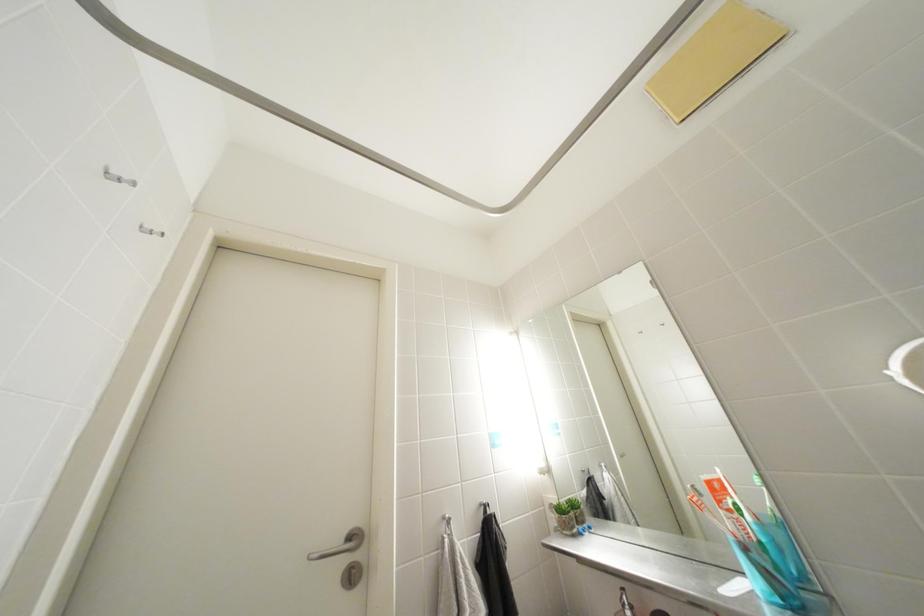
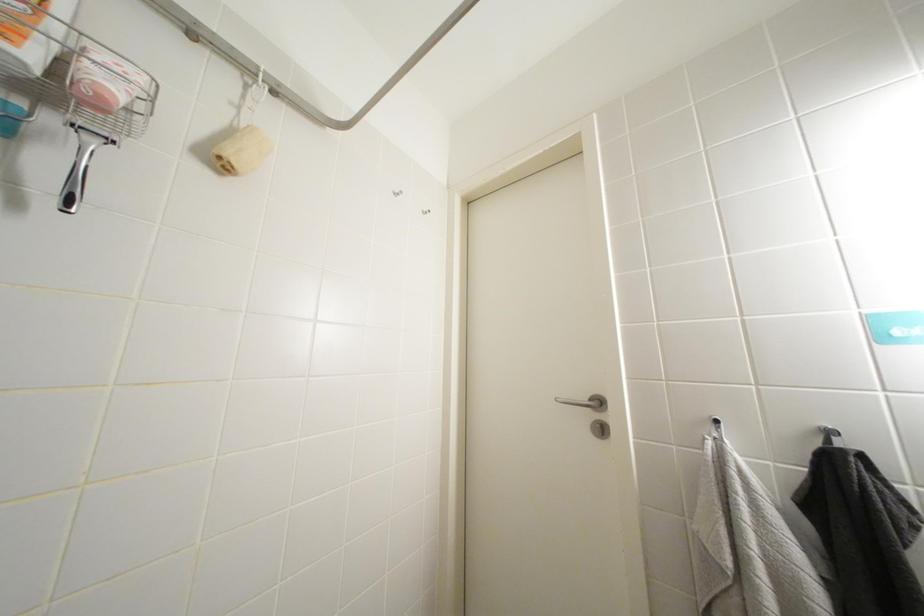
Question: The camera is either moving clockwise (left) or counter-clockwise (right) around the object. The first image is from the beginning of the video and the second image is from the end. Is the camera moving left or right when shooting the video?

Choices:
 (A) Left
 (B) Right

Answer: (B)